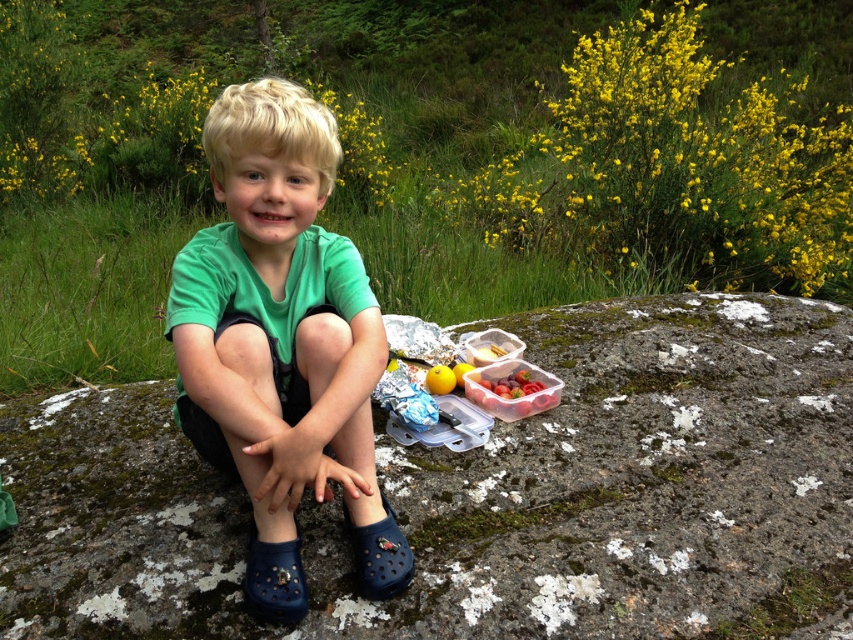
You are a photographer trying to capture the picnic scene. You want to ensure both the blue rubber shoe at lower left and the yellow matte apple at center are visible in the frame. Based on their positions, which object should you focus on first to include both in the shot?

The blue rubber shoe at lower left is below the yellow matte apple at center. To include both in the frame, focus on the yellow matte apple at center first since it is higher up, ensuring the lower shoe remains within the shot.